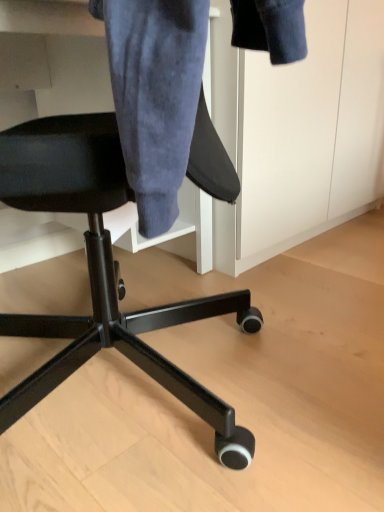
This screenshot has height=512, width=384. In order to click on vacant area that lies between denim jacket at upper center and black fabric chair at center in this screenshot , I will do `click(261, 295)`.